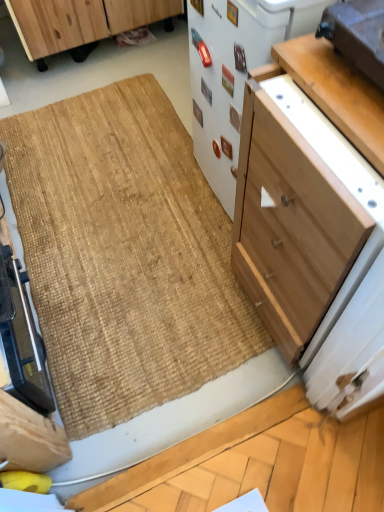
What do you see at coordinates (233, 72) in the screenshot? I see `white matte refrigerator at center, which is counted as the 2th appliance, starting from the left` at bounding box center [233, 72].

What do you see at coordinates (337, 92) in the screenshot? This screenshot has height=512, width=384. I see `light brown wood drawer at upper right` at bounding box center [337, 92].

How much space does matte brown toaster at upper right, the third appliance in the left-to-right sequence, occupy horizontally?

matte brown toaster at upper right, the third appliance in the left-to-right sequence, is 26.84 centimeters in width.

Describe the element at coordinates (22, 336) in the screenshot. I see `metallic silver toaster at lower left, arranged as the first appliance when viewed from the left` at that location.

The height and width of the screenshot is (512, 384). What do you see at coordinates (81, 21) in the screenshot?
I see `wooden cabinet at upper left, the second cabinetry viewed from the right` at bounding box center [81, 21].

The image size is (384, 512). I want to click on natural fiber doormat at center, so click(x=124, y=254).

You are a GUI agent. You are given a task and a screenshot of the screen. Output one action in this format:
    pyautogui.click(x=<x>, y=<y>)
    Task: Click on the white matte refrigerator at center, which is counted as the 2th appliance, starting from the left
    
    Given the screenshot: What is the action you would take?
    pyautogui.click(x=233, y=72)

Considering the points (178, 338) and (313, 242), which point is behind, point (178, 338) or point (313, 242)?

The point (178, 338) is farther from the camera.

Between natural fiber doormat at center and light wood cabinet at center-right, positioned as the first cabinetry in front-to-back order, which one has larger width?

With larger width is natural fiber doormat at center.

From the image's perspective, is natural fiber doormat at center located beneath light wood cabinet at center-right, the first cabinetry viewed from the right?

No, from the image's perspective, natural fiber doormat at center is not beneath light wood cabinet at center-right, the first cabinetry viewed from the right.

Is light wood cabinet at center-right, the first cabinetry viewed from the right, looking in the opposite direction of light brown wood drawer at upper right?

light wood cabinet at center-right, the first cabinetry viewed from the right, is not turned away from light brown wood drawer at upper right.

Is light wood cabinet at center-right, the first cabinetry viewed from the right, taller than light brown wood drawer at upper right?

Indeed, light wood cabinet at center-right, the first cabinetry viewed from the right, has a greater height compared to light brown wood drawer at upper right.

From the image's perspective, is white matte refrigerator at center, which is counted as the 2th appliance, starting from the left, above or below matte brown toaster at upper right, which appears as the 1th appliance when viewed from the right?

white matte refrigerator at center, which is counted as the 2th appliance, starting from the left, is above matte brown toaster at upper right, which appears as the 1th appliance when viewed from the right.

Can you confirm if white matte refrigerator at center, acting as the second appliance starting from the right, is thinner than matte brown toaster at upper right, the third appliance in the left-to-right sequence?

In fact, white matte refrigerator at center, acting as the second appliance starting from the right, might be wider than matte brown toaster at upper right, the third appliance in the left-to-right sequence.

Is white matte refrigerator at center, which is counted as the 2th appliance, starting from the left, in front of matte brown toaster at upper right, which appears as the 1th appliance when viewed from the right?

No.

Who is bigger, white matte refrigerator at center, acting as the second appliance starting from the right, or matte brown toaster at upper right, the third appliance in the left-to-right sequence?

With larger size is white matte refrigerator at center, acting as the second appliance starting from the right.

Does point (103, 404) come behind point (208, 127)?

That is False.

Is natural fiber doormat at center placed right next to white matte refrigerator at center, acting as the second appliance starting from the right?

No, natural fiber doormat at center is not next to white matte refrigerator at center, acting as the second appliance starting from the right.

From a real-world perspective, is natural fiber doormat at center physically below white matte refrigerator at center, acting as the second appliance starting from the right?

Yes.

Is natural fiber doormat at center aimed at white matte refrigerator at center, acting as the second appliance starting from the right?

No, natural fiber doormat at center is not aimed at white matte refrigerator at center, acting as the second appliance starting from the right.

Looking at this image, is the position of metallic silver toaster at lower left, arranged as the first appliance when viewed from the left, more distant than that of natural fiber doormat at center?

No, the depth of metallic silver toaster at lower left, arranged as the first appliance when viewed from the left, is less than that of natural fiber doormat at center.

How many degrees apart are the facing directions of metallic silver toaster at lower left, arranged as the first appliance when viewed from the left, and natural fiber doormat at center?

There is a 91.1-degree angle between the facing directions of metallic silver toaster at lower left, arranged as the first appliance when viewed from the left, and natural fiber doormat at center.

Is metallic silver toaster at lower left, arranged as the first appliance when viewed from the left, positioned beyond the bounds of natural fiber doormat at center?

Indeed, metallic silver toaster at lower left, arranged as the first appliance when viewed from the left, is completely outside natural fiber doormat at center.

From a real-world perspective, who is located lower, metallic silver toaster at lower left, placed as the third appliance when sorted from right to left, or natural fiber doormat at center?

natural fiber doormat at center, from a real-world perspective.

Which point is more distant from viewer, (x=29, y=38) or (x=229, y=68)?

The point (x=29, y=38) is more distant.

Measure the distance from wooden cabinet at upper left, the 2th cabinetry in the bottom-to-top sequence, to white matte refrigerator at center, which is counted as the 2th appliance, starting from the left.

wooden cabinet at upper left, the 2th cabinetry in the bottom-to-top sequence, and white matte refrigerator at center, which is counted as the 2th appliance, starting from the left, are 38.01 inches apart.

Is wooden cabinet at upper left, the 2th cabinetry in the front-to-back sequence, located outside white matte refrigerator at center, which is counted as the 2th appliance, starting from the left?

That's correct, wooden cabinet at upper left, the 2th cabinetry in the front-to-back sequence, is outside of white matte refrigerator at center, which is counted as the 2th appliance, starting from the left.

Would you say wooden cabinet at upper left, the 1th cabinetry viewed from the top, is a long distance from white matte refrigerator at center, which is counted as the 2th appliance, starting from the left?

They are positioned close to each other.

Consider the image. What's the angular difference between light wood cabinet at center-right, which is the 2th cabinetry from back to front, and wooden cabinet at upper left, the second cabinetry viewed from the right,'s facing directions?

They differ by 90.3 degrees in their facing directions.

Would you say light wood cabinet at center-right, which appears as the second cabinetry when viewed from the left, contains wooden cabinet at upper left, which is the first cabinetry from back to front?

That's incorrect, wooden cabinet at upper left, which is the first cabinetry from back to front, is not inside light wood cabinet at center-right, which appears as the second cabinetry when viewed from the left.

Is point (362, 234) closer or farther from the camera than point (49, 14)?

Point (362, 234).

From a real-world perspective, is light wood cabinet at center-right, which is the 2th cabinetry from back to front, located higher than wooden cabinet at upper left, which is the first cabinetry from back to front?

Yes, from a real-world perspective, light wood cabinet at center-right, which is the 2th cabinetry from back to front, is on top of wooden cabinet at upper left, which is the first cabinetry from back to front.

Find the location of a particular element. doormat on the left of light wood cabinet at center-right, which appears as the second cabinetry when viewed from the left is located at coordinates coord(124,254).

The width and height of the screenshot is (384, 512). Find the location of `table behind the light wood cabinet at center-right, positioned as the first cabinetry in front-to-back order`. table behind the light wood cabinet at center-right, positioned as the first cabinetry in front-to-back order is located at coordinates (337, 92).

From the image, which object appears to be farther from light wood cabinet at center-right, which is the 2th cabinetry from back to front, white matte refrigerator at center, acting as the second appliance starting from the right, or wooden cabinet at upper left, the 1th cabinetry viewed from the top?

Among the two, wooden cabinet at upper left, the 1th cabinetry viewed from the top, is located further to light wood cabinet at center-right, which is the 2th cabinetry from back to front.

Looking at this image, from the image, which object appears to be nearer to metallic silver toaster at lower left, placed as the third appliance when sorted from right to left, natural fiber doormat at center or white matte refrigerator at center, which is counted as the 2th appliance, starting from the left?

natural fiber doormat at center is positioned closer to the anchor metallic silver toaster at lower left, placed as the third appliance when sorted from right to left.

Looking at the image, which one is located closer to white matte refrigerator at center, acting as the second appliance starting from the right, natural fiber doormat at center or wooden cabinet at upper left, the 1th cabinetry viewed from the top?

Based on the image, natural fiber doormat at center appears to be nearer to white matte refrigerator at center, acting as the second appliance starting from the right.

Estimate the real-world distances between objects in this image. Which object is further from wooden cabinet at upper left, the 2th cabinetry in the bottom-to-top sequence, metallic silver toaster at lower left, arranged as the first appliance when viewed from the left, or natural fiber doormat at center?

metallic silver toaster at lower left, arranged as the first appliance when viewed from the left, is positioned further to the anchor wooden cabinet at upper left, the 2th cabinetry in the bottom-to-top sequence.

Based on their spatial positions, is light wood cabinet at center-right, the first cabinetry viewed from the right, or metallic silver toaster at lower left, arranged as the first appliance when viewed from the left, further from natural fiber doormat at center?

light wood cabinet at center-right, the first cabinetry viewed from the right, is positioned further to the anchor natural fiber doormat at center.

From the image, which object appears to be nearer to matte brown toaster at upper right, the third appliance in the left-to-right sequence, light wood cabinet at center-right, which appears as the 2th cabinetry when viewed from the top, or wooden cabinet at upper left, the 2th cabinetry in the bottom-to-top sequence?

Among the two, light wood cabinet at center-right, which appears as the 2th cabinetry when viewed from the top, is located nearer to matte brown toaster at upper right, the third appliance in the left-to-right sequence.

Considering their positions, is white matte refrigerator at center, which is counted as the 2th appliance, starting from the left, positioned further to matte brown toaster at upper right, which appears as the 1th appliance when viewed from the right, than wooden cabinet at upper left, the 2th cabinetry in the bottom-to-top sequence?

Among the two, wooden cabinet at upper left, the 2th cabinetry in the bottom-to-top sequence, is located further to matte brown toaster at upper right, which appears as the 1th appliance when viewed from the right.

Considering their positions, is metallic silver toaster at lower left, placed as the third appliance when sorted from right to left, positioned closer to light wood cabinet at center-right, which is the 2th cabinetry from back to front, than matte brown toaster at upper right, the third appliance in the left-to-right sequence?

The object closer to light wood cabinet at center-right, which is the 2th cabinetry from back to front, is matte brown toaster at upper right, the third appliance in the left-to-right sequence.

The height and width of the screenshot is (512, 384). In order to click on appliance between natural fiber doormat at center and light brown wood drawer at upper right from left to right in this screenshot , I will do `click(233, 72)`.

Locate an element on the screen. This screenshot has height=512, width=384. table between metallic silver toaster at lower left, arranged as the first appliance when viewed from the left, and light wood cabinet at center-right, which is the 2th cabinetry from back to front, in the horizontal direction is located at coordinates (337, 92).

The height and width of the screenshot is (512, 384). I want to click on table located between natural fiber doormat at center and matte brown toaster at upper right, the third appliance in the left-to-right sequence, in the left-right direction, so 337,92.

Where is `doormat between metallic silver toaster at lower left, placed as the third appliance when sorted from right to left, and light brown wood drawer at upper right, in the horizontal direction`? This screenshot has height=512, width=384. doormat between metallic silver toaster at lower left, placed as the third appliance when sorted from right to left, and light brown wood drawer at upper right, in the horizontal direction is located at coordinates (124, 254).